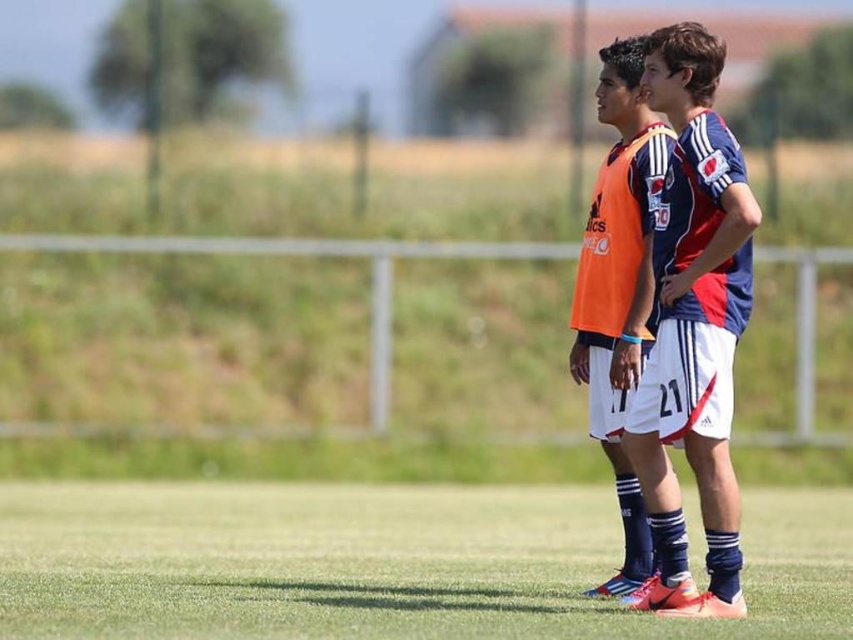
Which is more to the left, blue jersey at center or orange jersey at center?

From the viewer's perspective, orange jersey at center appears more on the left side.

Is blue jersey at center taller than orange jersey at center?

Yes, blue jersey at center is taller than orange jersey at center.

Who is more distant from viewer, [703,131] or [625,465]?

Positioned behind is point [625,465].

Locate an element on the screen. The height and width of the screenshot is (640, 853). blue jersey at center is located at coordinates (693, 324).

Can you confirm if green turf at lower center is bigger than orange jersey at center?

Indeed, green turf at lower center has a larger size compared to orange jersey at center.

Is point (219, 582) positioned after point (639, 136)?

Yes, point (219, 582) is farther from viewer.

What are the coordinates of `green turf at lower center` in the screenshot? It's located at (381, 563).

Is point (161, 499) closer to camera compared to point (714, 182)?

No.

Is green turf at lower center positioned at the back of blue jersey at center?

No, green turf at lower center is in front of blue jersey at center.

Is point (397, 506) farther from viewer compared to point (682, 138)?

Yes, it is.

The image size is (853, 640). Identify the location of green turf at lower center. (381, 563).